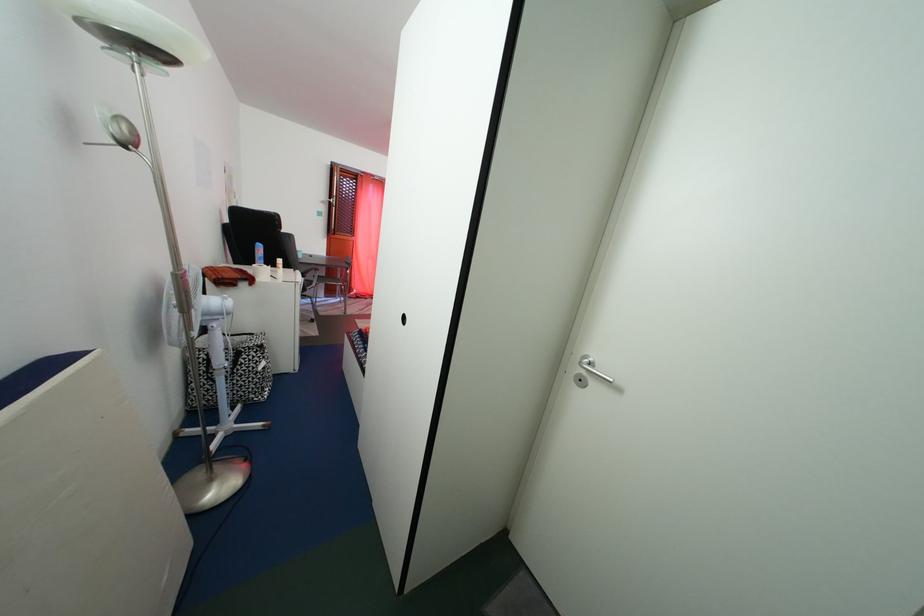
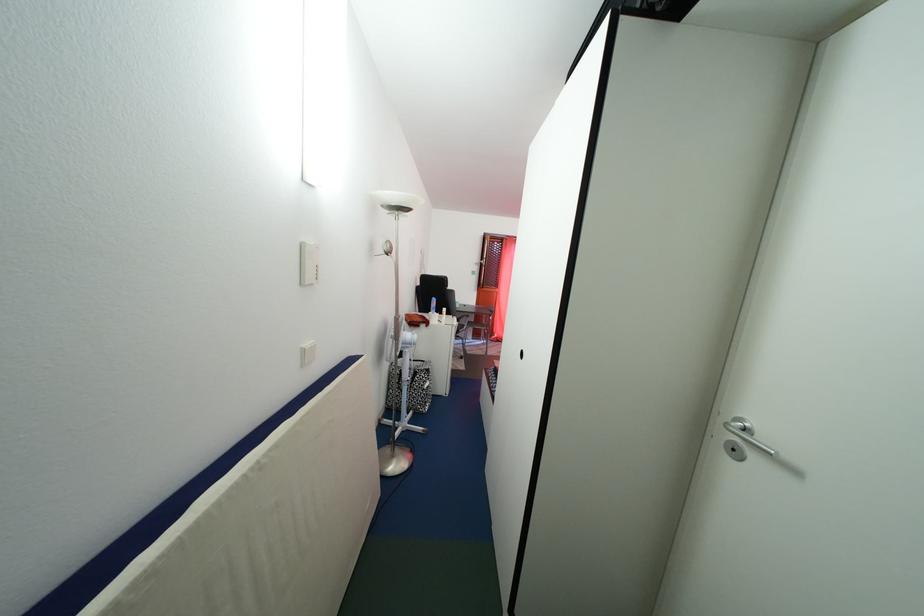
Locate, in the second image, the point that corresponds to point 590,387 in the first image.

(743, 456)